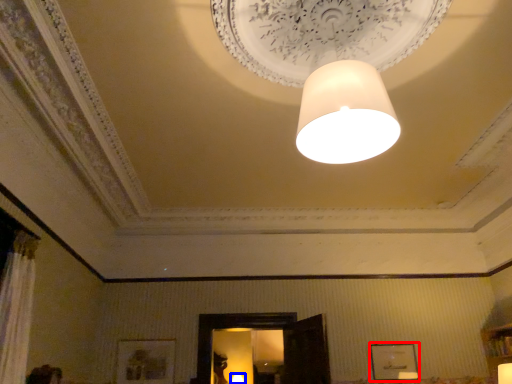
Question: Which object appears farthest to the camera in this image, picture frame (highlighted by a red box) or lamp (highlighted by a blue box)?

Choices:
 (A) picture frame
 (B) lamp

Answer: (B)